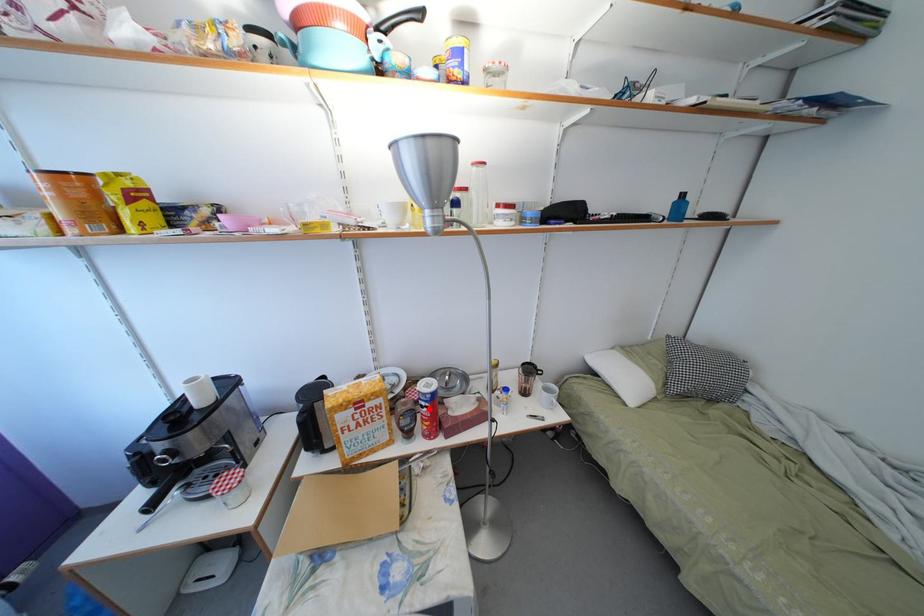
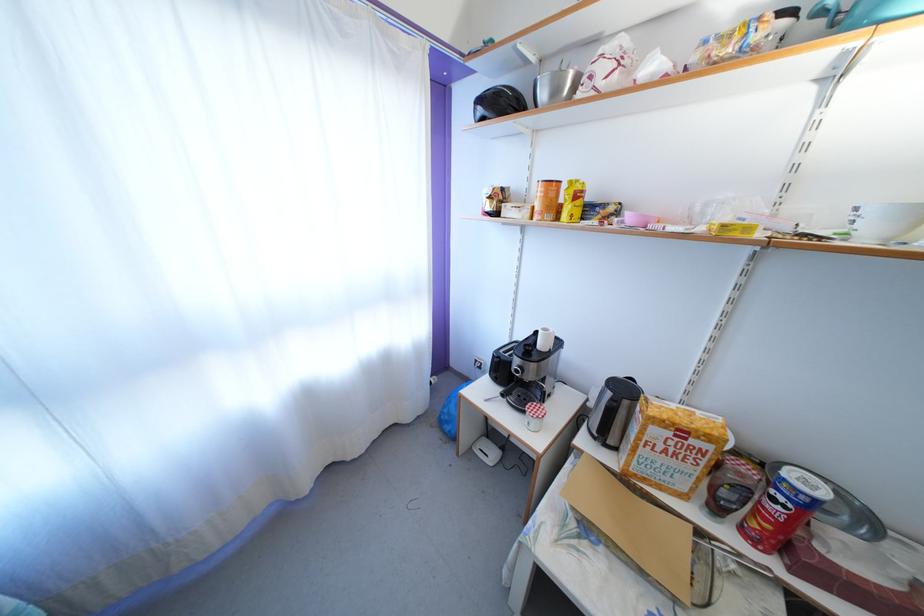
Question: I am providing you with two images of the same scene from different viewpoints. A red point is marked on the first image. Can you still see the location of the red point in image 2?

Choices:
 (A) Yes
 (B) No

Answer: (A)